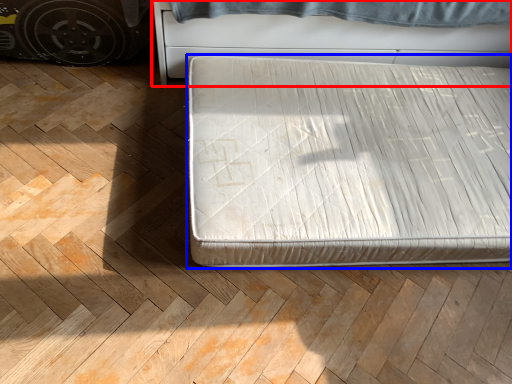
Question: Which point is closer to the camera, furniture (highlighted by a red box) or bed (highlighted by a blue box)?

Choices:
 (A) furniture
 (B) bed

Answer: (B)